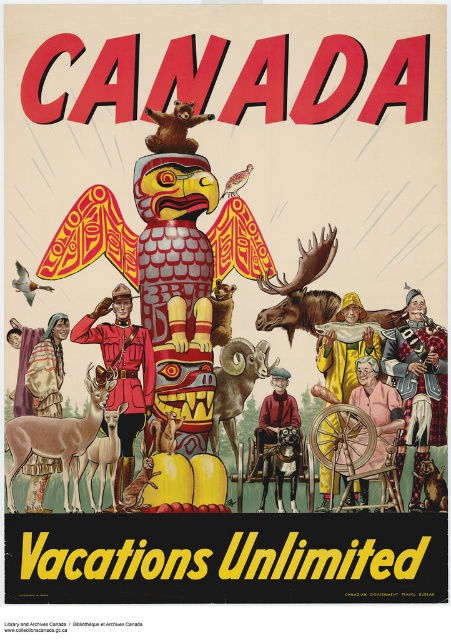
Between point (157, 180) and point (192, 109), which one is positioned in front?

Point (192, 109) is in front.

Does reddish-brown carved totem pole at center appear on the left side of brown furry bear at upper center?

Incorrect, reddish-brown carved totem pole at center is not on the left side of brown furry bear at upper center.

Is point (184, 161) in front of point (151, 141)?

Yes.

At what (x,y) coordinates should I click in order to perform the action: click on reddish-brown carved totem pole at center. Please return your answer as a coordinate pair (x, y). This screenshot has width=451, height=640. Looking at the image, I should click on (178, 288).

Find the location of a particular element. Image resolution: width=451 pixels, height=640 pixels. brown fur rabbit at center is located at coordinates (164, 433).

Does brown fur rabbit at center appear under white matte bird at lower left?

Yes.

Is point (157, 435) closer to viewer compared to point (30, 278)?

Yes, point (157, 435) is closer to viewer.

I want to click on brown fur rabbit at center, so click(x=164, y=433).

Does brown velvet deer at lower left have a greater width compared to smooth brown bird at center?

Yes.

Is point (23, 458) behind point (230, 186)?

No.

Between point (90, 408) and point (239, 179), which one is positioned behind?

Positioned behind is point (239, 179).

Locate an element on the screen. Image resolution: width=451 pixels, height=640 pixels. brown velvet deer at lower left is located at coordinates (59, 436).